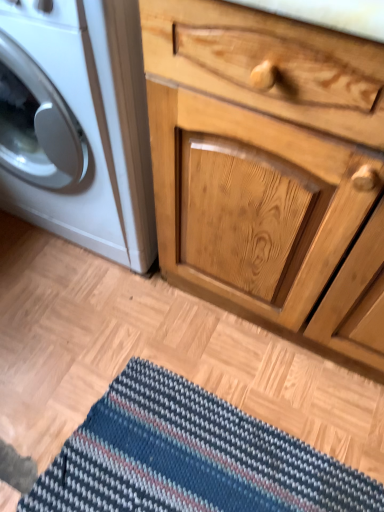
Find the location of `vacant area that is in front of natural wood cabinet at center`. vacant area that is in front of natural wood cabinet at center is located at coordinates (253, 428).